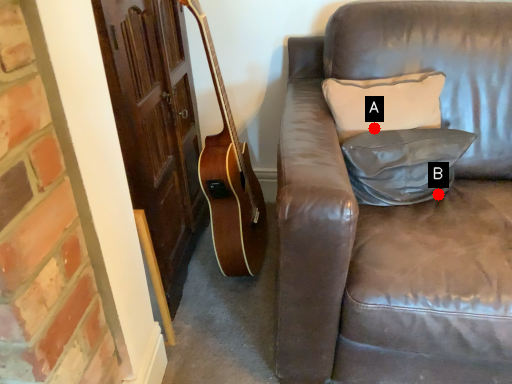
Question: Two points are circled on the image, labeled by A and B beside each circle. Among these points, which one is nearest to the camera?

Choices:
 (A) A is closer
 (B) B is closer

Answer: (B)